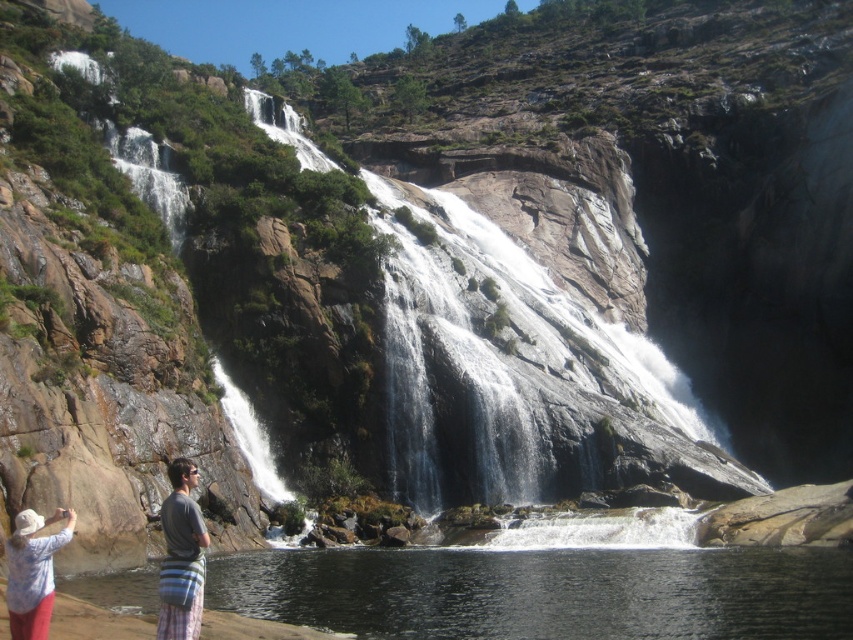
Between clear water at lower left and white cotton hat at lower left, which one is positioned higher?

white cotton hat at lower left is higher up.

Is clear water at lower left bigger than white cotton hat at lower left?

Correct, clear water at lower left is larger in size than white cotton hat at lower left.

What do you see at coordinates (544, 592) in the screenshot? The height and width of the screenshot is (640, 853). I see `clear water at lower left` at bounding box center [544, 592].

Image resolution: width=853 pixels, height=640 pixels. Identify the location of clear water at lower left. 544,592.

Who is positioned more to the left, gray striped bag at lower left or white cotton hat at lower left?

white cotton hat at lower left is more to the left.

Between gray striped bag at lower left and white cotton hat at lower left, which one is positioned lower?

gray striped bag at lower left is lower down.

Is point (190, 625) farther from viewer compared to point (38, 528)?

No, (190, 625) is closer to viewer.

Locate an element on the screen. gray striped bag at lower left is located at coordinates (181, 556).

Which is in front, point (479, 564) or point (193, 577)?

Point (193, 577) is in front.

Based on the photo, does clear water at lower left have a lesser height compared to gray striped bag at lower left?

Yes, clear water at lower left is shorter than gray striped bag at lower left.

Between point (459, 621) and point (194, 564), which one is positioned in front?

Point (194, 564) is more forward.

At what (x,y) coordinates should I click in order to perform the action: click on clear water at lower left. Please return your answer as a coordinate pair (x, y). This screenshot has height=640, width=853. Looking at the image, I should click on (544, 592).